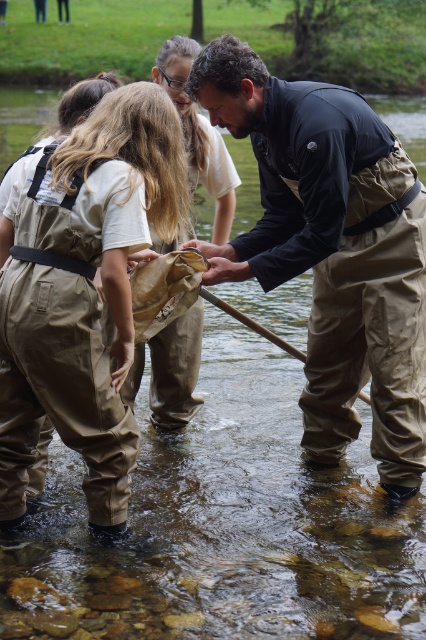
You are a photographer trying to capture a photo of the two people wearing the matte black waders at center and the tan waterproof overalls at center. Which one should you focus on first if you want to photograph them from left to right?

You should focus on the tan waterproof overalls at center first because it is positioned to the left of the matte black waders at center.

You are a photographer planning to capture a closeup of the person holding the net. Since you want to ensure both the matte black waders at center and the brown suede waders at center are visible in the frame, which waders should you focus on to include both?

The matte black waders at center is larger in size than the brown suede waders at center, so focusing on the matte black waders at center would ensure both are visible in the frame.